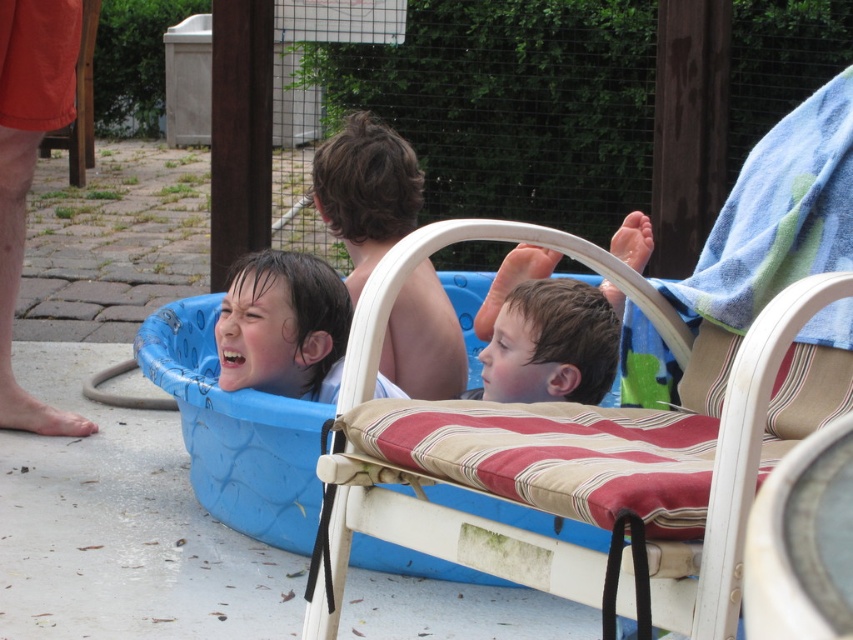
From the picture: You are a parent trying to ensure your child can comfortably sit in the white striped cushioned beach chair at center while keeping their shiny brown hair at center visible. Based on the scene description, will the chair be tall enough for the child to see over it?

The white striped cushioned beach chair at center has a greater height compared to shiny brown hair at center, so the child may not be able to see over the chair since the chair is taller than their hair.

You are a photographer trying to capture a clear shot of the shiny brown hair at center without any obstructions. The white striped cushioned beach chair at center is in the way. Can you move the chair to the side to get a better view?

The white striped cushioned beach chair at center is positioned under shiny brown hair at center, so moving the chair would allow you to see the shiny brown hair at center without obstruction.